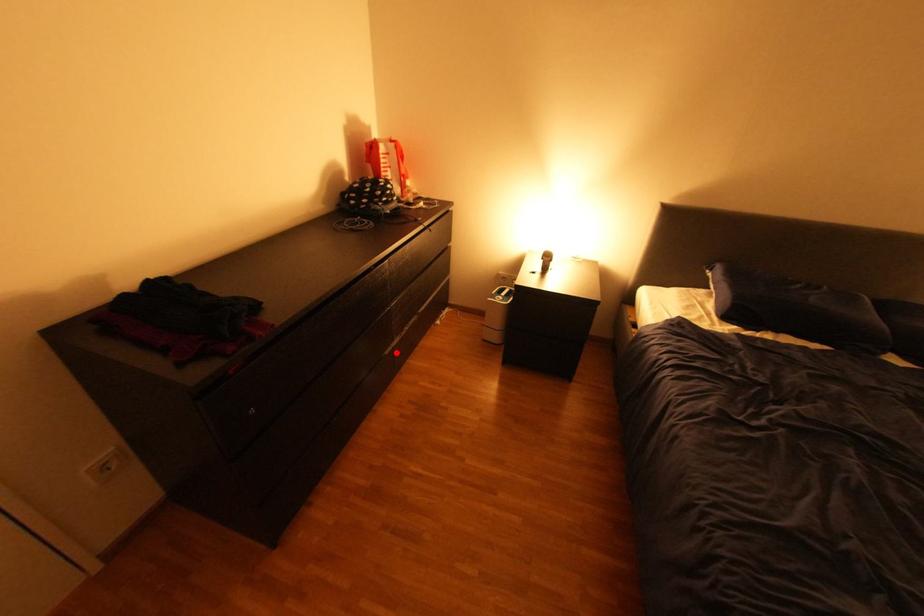
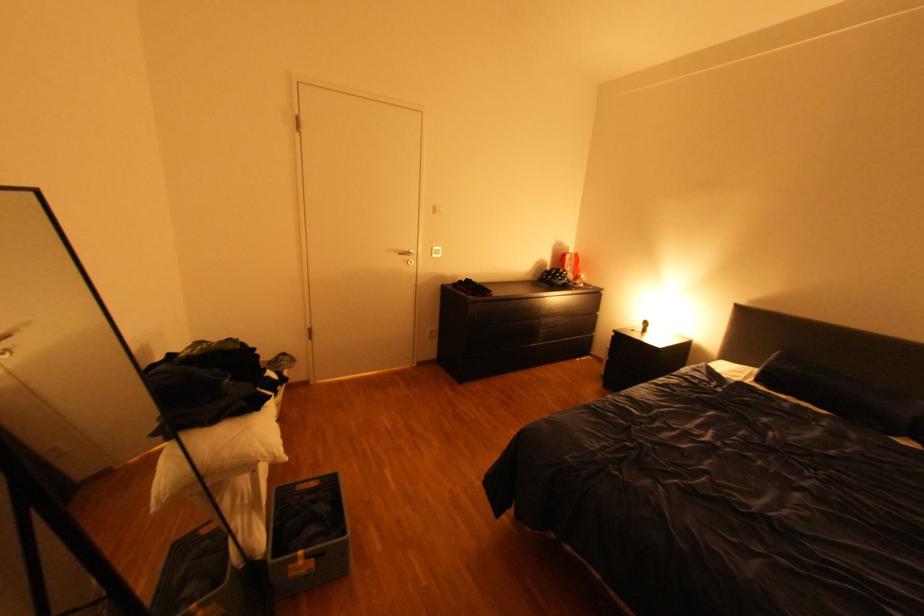
The point at the highlighted location is marked in the first image. Where is the corresponding point in the second image?

(542, 345)